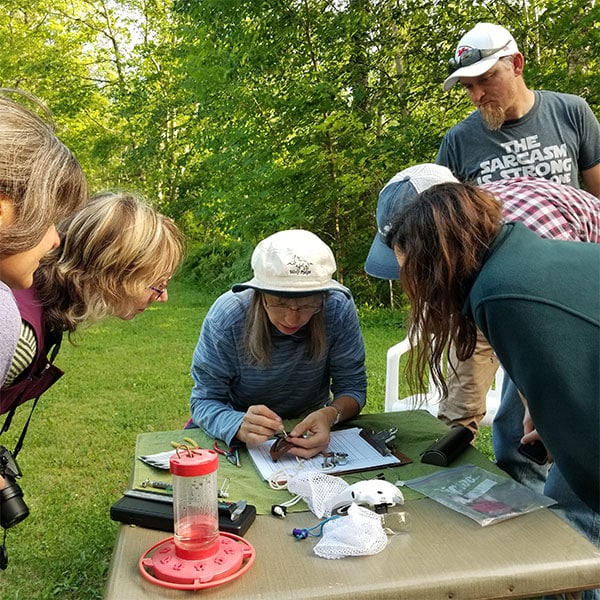
Identify the location of clipboard. Image resolution: width=600 pixels, height=600 pixels. (402, 458).